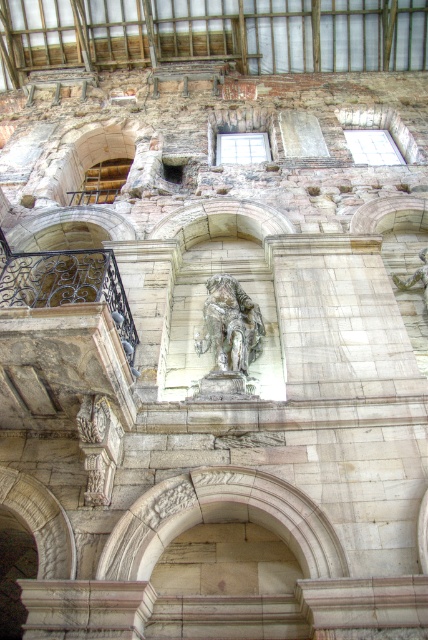
Question: Which of these objects is positioned farthest from the bronze statue at center?

Choices:
 (A) stone archway at center
 (B) green mossy stone statue at center

Answer: (B)

Question: Is stone archway at center closer to the viewer compared to bronze statue at center?

Choices:
 (A) yes
 (B) no

Answer: (A)

Question: Can you confirm if stone archway at center is positioned to the left of bronze statue at center?

Choices:
 (A) yes
 (B) no

Answer: (A)

Question: Which point appears farthest from the camera in this image?

Choices:
 (A) (228, 310)
 (B) (416, 275)

Answer: (B)

Question: Is stone archway at center smaller than green mossy stone statue at center?

Choices:
 (A) no
 (B) yes

Answer: (A)

Question: Estimate the real-world distances between objects in this image. Which object is farther from the bronze statue at center?

Choices:
 (A) stone archway at center
 (B) green mossy stone statue at center

Answer: (B)